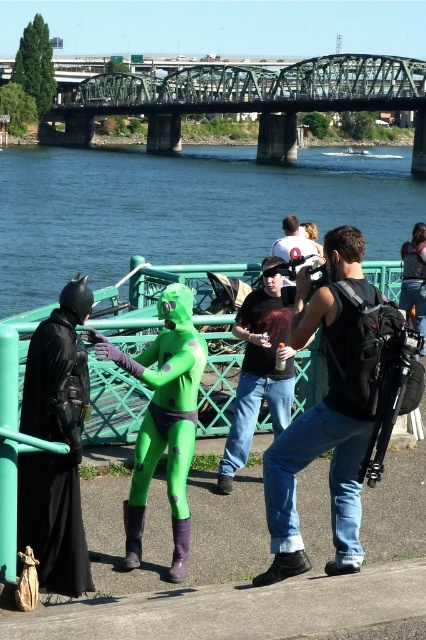
Between point (134, 97) and point (284, 244), which one is positioned in front?

Point (284, 244)

Who is lower down, green painted steel bridge at upper center or white cotton t-shirt at center?

Positioned lower is white cotton t-shirt at center.

Is point (275, 74) behind point (294, 257)?

Yes, it is behind point (294, 257).

Find the location of `green painted steel bridge at upper center`. green painted steel bridge at upper center is located at coordinates (252, 99).

Who is shorter, green painted steel bridge at upper center or green spandex suit at center?

green spandex suit at center is shorter.

Does green painted steel bridge at upper center have a greater height compared to green spandex suit at center?

Correct, green painted steel bridge at upper center is much taller as green spandex suit at center.

Identify the location of green painted steel bridge at upper center. (252, 99).

Between blue water at center and black matte cape at left, which one appears on the left side from the viewer's perspective?

blue water at center

Describe the element at coordinates (183, 209) in the screenshot. I see `blue water at center` at that location.

Between point (173, 234) and point (80, 408), which one is positioned behind?

The point (173, 234) is more distant.

Find the location of a particular element. The image size is (426, 640). blue water at center is located at coordinates (183, 209).